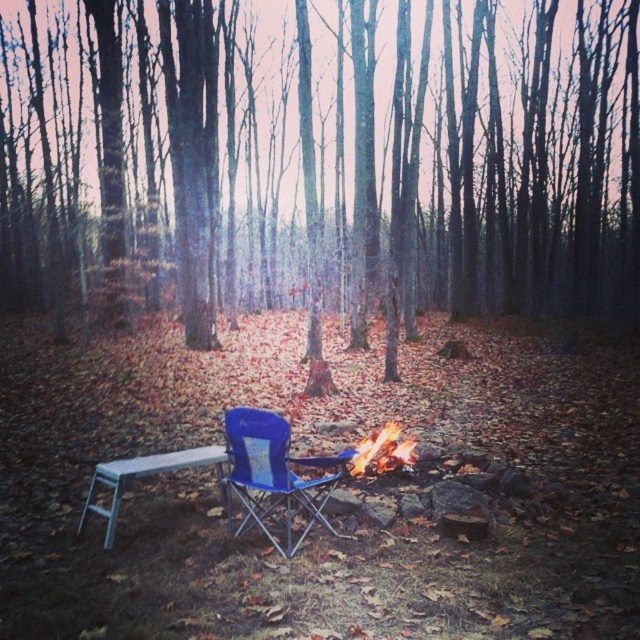
What do you see at coordinates (145, 476) in the screenshot? This screenshot has height=640, width=640. I see `metallic silver stool at lower left` at bounding box center [145, 476].

Locate an element on the screen. metallic silver stool at lower left is located at coordinates (145, 476).

Is blue mesh folding chair at center smaller than flaming wood fire at center?

No.

Does point (323, 476) come behind point (406, 452)?

No, it is in front of (406, 452).

This screenshot has height=640, width=640. What do you see at coordinates (275, 474) in the screenshot?
I see `blue mesh folding chair at center` at bounding box center [275, 474].

Find the location of a particular element. blue mesh folding chair at center is located at coordinates (275, 474).

Between point (291, 520) and point (116, 465), which one is positioned behind?

The point (291, 520) is behind.

Can you confirm if blue mesh folding chair at center is positioned above metallic silver stool at lower left?

Yes.

This screenshot has width=640, height=640. Describe the element at coordinates (275, 474) in the screenshot. I see `blue mesh folding chair at center` at that location.

Locate an element on the screen. blue mesh folding chair at center is located at coordinates (275, 474).